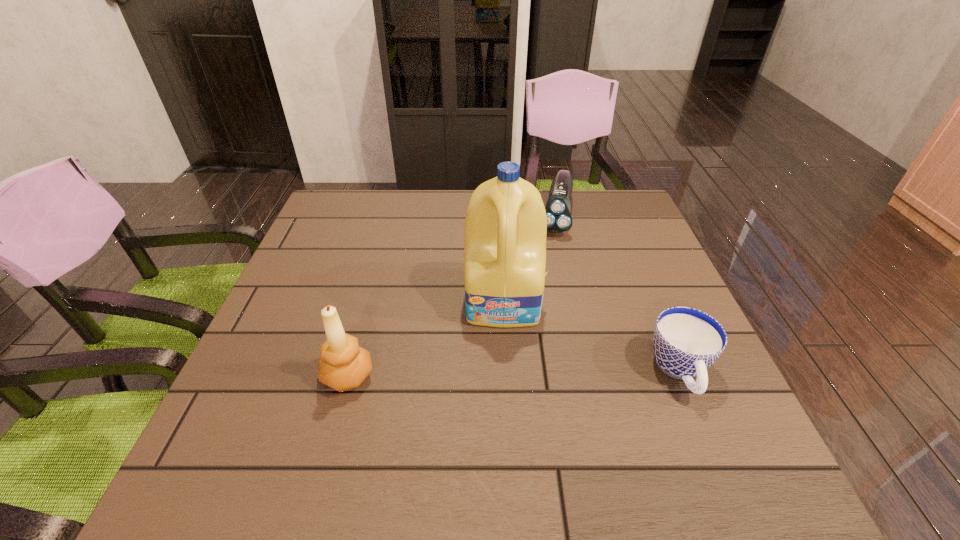
Locate an element on the screen. Image resolution: width=960 pixels, height=540 pixels. free spot on the desktop that is between the third shortest object and the cup and is positioned on the label of the third nearest object is located at coordinates (505, 374).

This screenshot has width=960, height=540. Find the location of `free spot on the desktop that is between the leftmost object and the rightmost object and is positioned on the head of the third object from left to right`. free spot on the desktop that is between the leftmost object and the rightmost object and is positioned on the head of the third object from left to right is located at coordinates (524, 374).